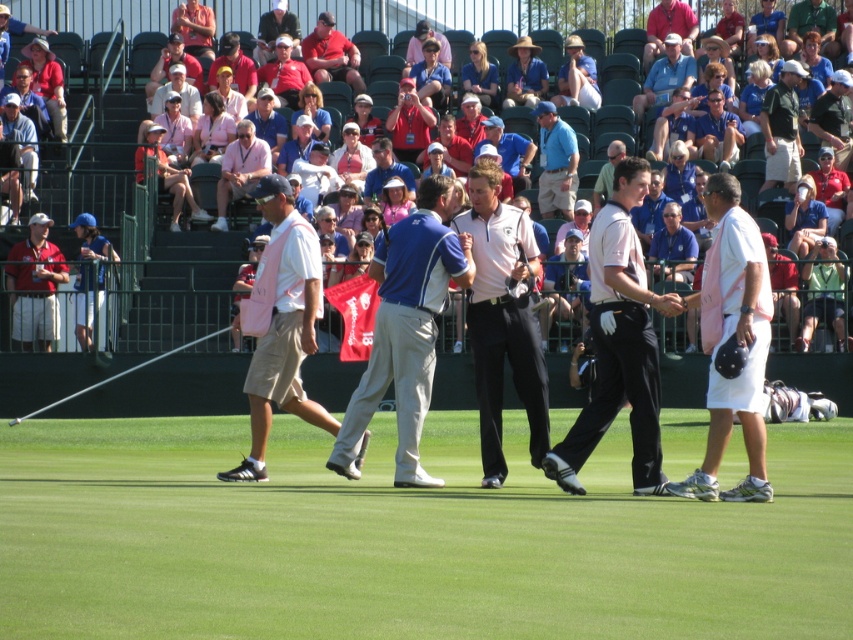
You are a photographer at the golf tournament. You want to capture a photo of the pink fabric shirt at center and the light blue shirt at center such that both are visible in the frame. Based on their positions, which shirt should be placed lower in the photo to ensure both are visible?

The pink fabric shirt at center is located below the light blue shirt at center, so to ensure both are visible in the photo, the pink fabric shirt at center should be placed lower in the frame.

Based on the photo, you are a photographer at the golf tournament. You need to capture a photo that includes both the pink fabric shirt at center and the light blue shirt at center. Based on their positions, which shirt should you focus on first to ensure both are in the frame?

The pink fabric shirt at center is positioned on the right side of light blue shirt at center. To capture both in the frame, focus on the light blue shirt at center first as it is on the left, allowing the photographer to adjust the camera to include the pink fabric shirt at center on the right side.

What are the coordinates of the white cotton polo shirt at center?

The coordinates of the white cotton polo shirt at center are at point (737, 342).